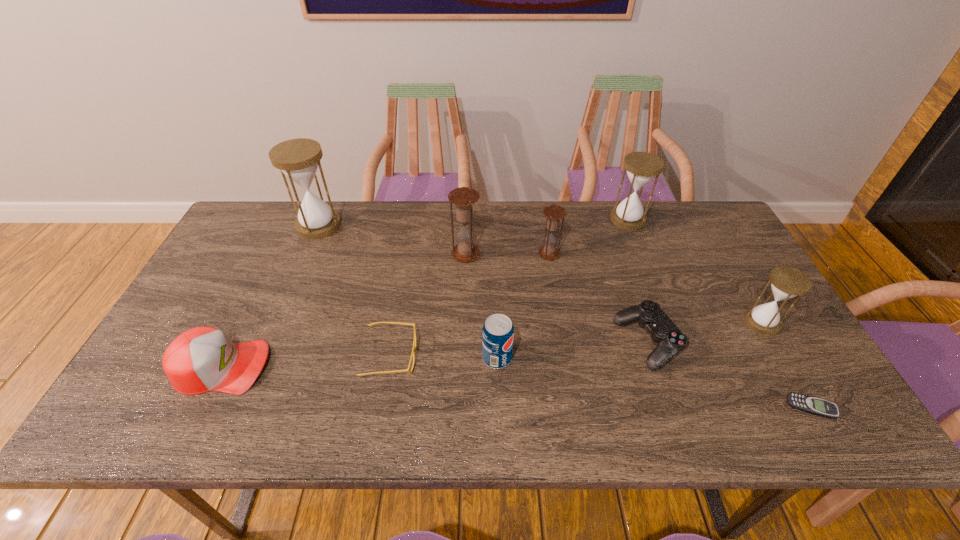
This screenshot has height=540, width=960. Find the location of `the biggest white hourglass`. the biggest white hourglass is located at coordinates (298, 159).

At what (x,y) coordinates should I click in order to perform the action: click on the leftmost white hourglass. Please return your answer as a coordinate pair (x, y). The image size is (960, 540). Looking at the image, I should click on tap(298, 159).

Identify the location of the bigger brown hourglass. (463, 198).

I want to click on the seventh object from right to left, so click(x=463, y=198).

Image resolution: width=960 pixels, height=540 pixels. Identify the location of the second white hourglass from left to right. (642, 167).

Where is `the second smallest white hourglass`? Image resolution: width=960 pixels, height=540 pixels. the second smallest white hourglass is located at coordinates point(642,167).

Identify the location of the fifth object from right to left. (554, 213).

At what (x,y) coordinates should I click in order to perform the action: click on the right brown hourglass. Please return your answer as a coordinate pair (x, y). The height and width of the screenshot is (540, 960). Looking at the image, I should click on (554, 213).

Locate an element on the screen. This screenshot has height=540, width=960. the rightmost white hourglass is located at coordinates (787, 282).

At what (x,y) coordinates should I click in order to perform the action: click on the smallest white hourglass. Please return your answer as a coordinate pair (x, y). Looking at the image, I should click on (787, 282).